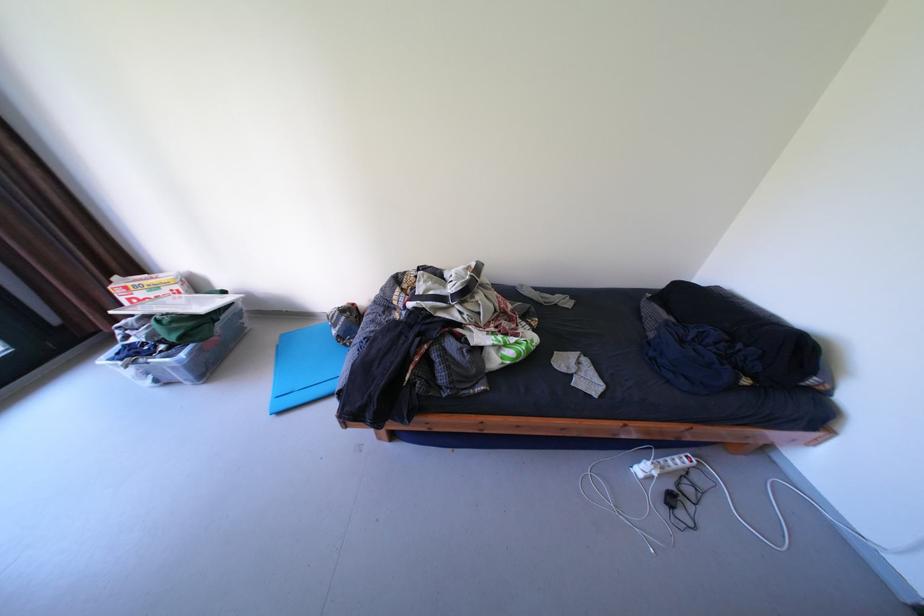
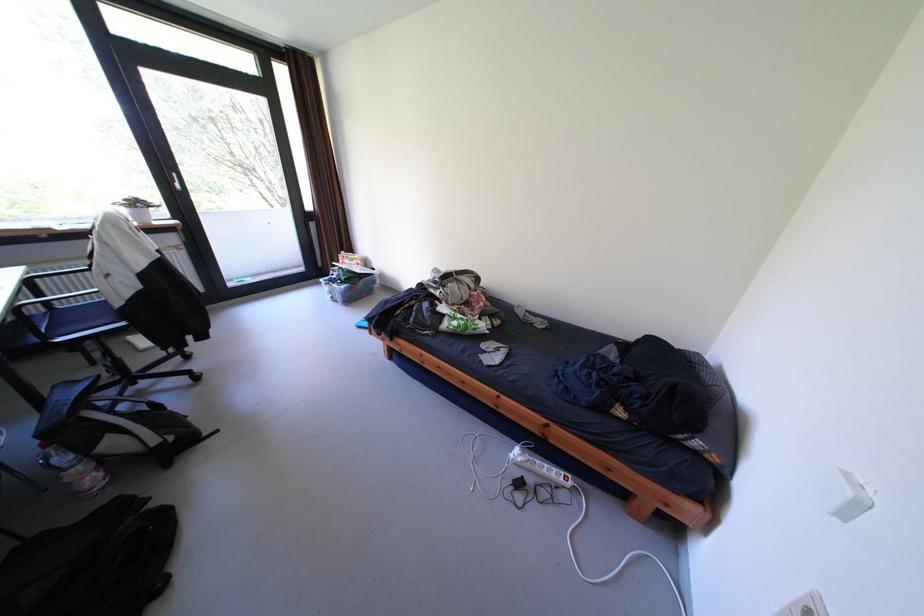
In the second image, find the point that corresponds to (x=181, y=331) in the first image.

(355, 275)